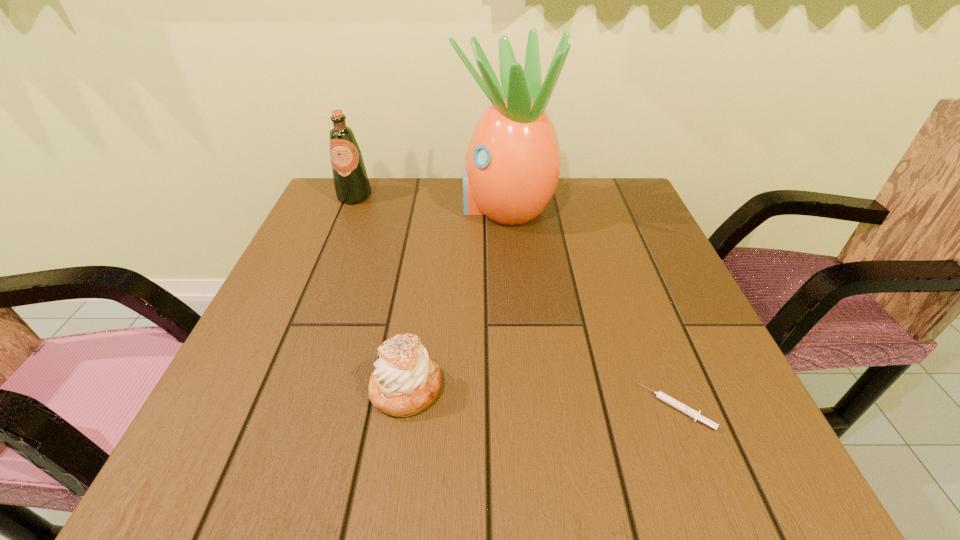
This screenshot has height=540, width=960. What are the coordinates of `vacant area that satisfies the following two spatial constraints: 1. on the front-facing side of the syringe; 2. on the right side of the second tallest object` in the screenshot? It's located at (267, 408).

In order to click on vacant position in the image that satisfies the following two spatial constraints: 1. at the entrance of the tallest object; 2. on the left side of the rightmost object in this screenshot , I will do `click(521, 408)`.

Where is `free space that satisfies the following two spatial constraints: 1. on the front-facing side of the third shortest object; 2. on the left side of the second shortest object`? free space that satisfies the following two spatial constraints: 1. on the front-facing side of the third shortest object; 2. on the left side of the second shortest object is located at coordinates (276, 388).